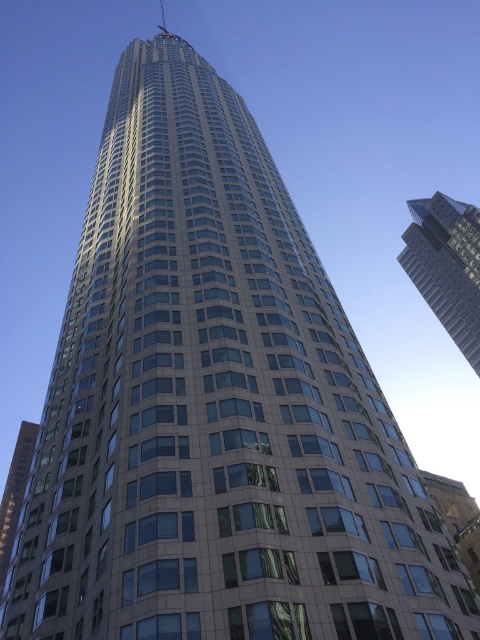
You are an architect observing the image. You need to determine the spatial relationship between the glassy reflective skyscraper at upper right and the glassy reflective building at lower left. Which one is positioned higher in the image?

The glassy reflective skyscraper at upper right is positioned higher than the glassy reflective building at lower left in the image.

You are an architect analyzing the layout of the urban area. You need to determine the exact coordinates of the glassy reflective skyscraper at upper right. What are its coordinates?

The glassy reflective skyscraper at upper right is located at coordinates point (446,266).